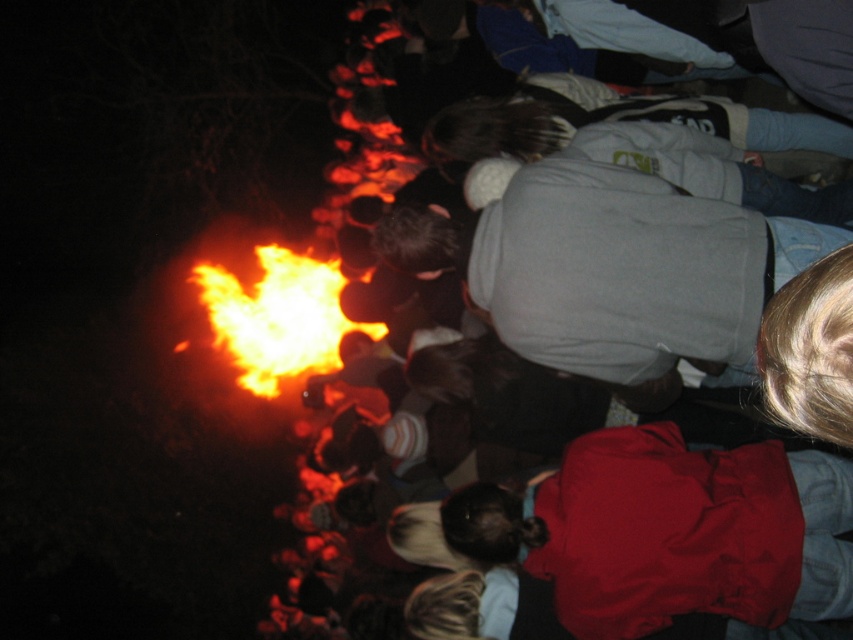
You are standing in the nighttime scene with the large fire. You see a point at coordinates (x=671, y=531). What object is this point located on?

The point at coordinates (x=671, y=531) is located on the matte red jacket at lower right.

You are standing at the point marked as point [396,189] in the nighttime scene with a large fire. You want to move 10 feet closer to the fire. After moving, will you be within 10 feet of the fire?

The point [396,189] is 20.42 feet away from the viewer. Moving 10 feet closer would place you at 10.42 feet away from the fire. Since 10.42 feet is more than 10 feet, you would not be within 10 feet of the fire.